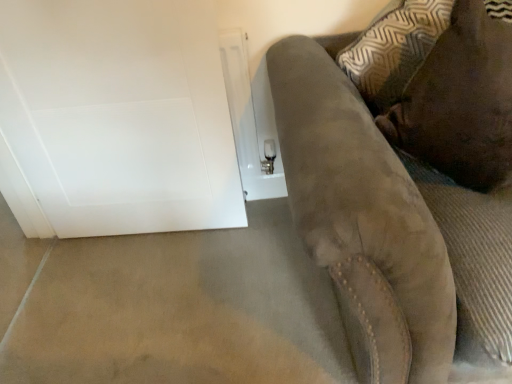
Identify the location of vacant area on top of beige carpet at lower left (from a real-world perspective). This screenshot has height=384, width=512. (165, 286).